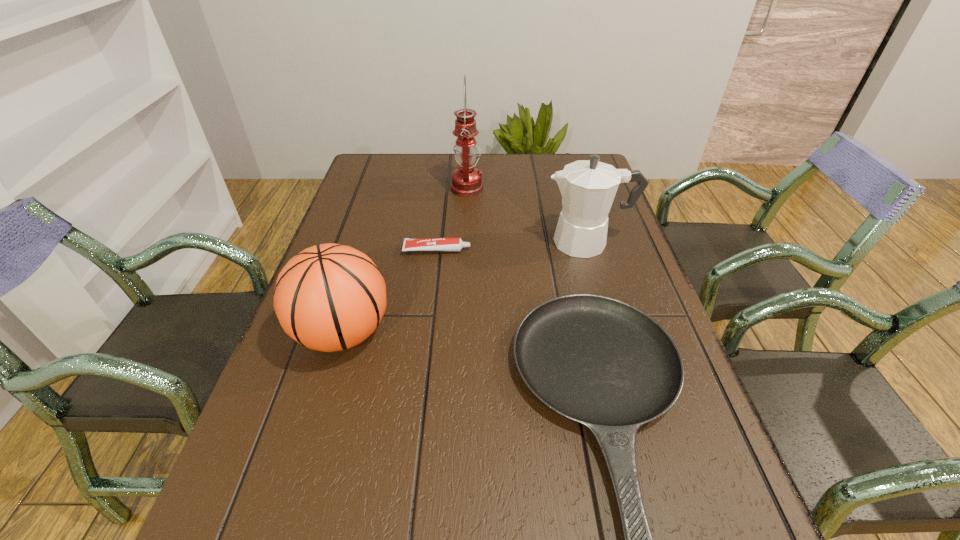
Where is `unoccupied position between the basketball and the tallest object`? The width and height of the screenshot is (960, 540). unoccupied position between the basketball and the tallest object is located at coordinates (405, 260).

Locate an element on the screen. Image resolution: width=960 pixels, height=540 pixels. free point between the third shortest object and the toothpaste is located at coordinates (390, 291).

Locate an element on the screen. The image size is (960, 540). vacant space in between the toothpaste and the coffeepot is located at coordinates (513, 246).

The height and width of the screenshot is (540, 960). What are the coordinates of `free spot between the third shortest object and the tallest object` in the screenshot? It's located at (405, 260).

I want to click on vacant space in between the coffeepot and the third shortest object, so click(x=466, y=287).

This screenshot has height=540, width=960. In order to click on object that is the third nearest to the frying pan in this screenshot , I will do `click(329, 297)`.

This screenshot has width=960, height=540. I want to click on object that stands as the third closest to the toothpaste, so 588,187.